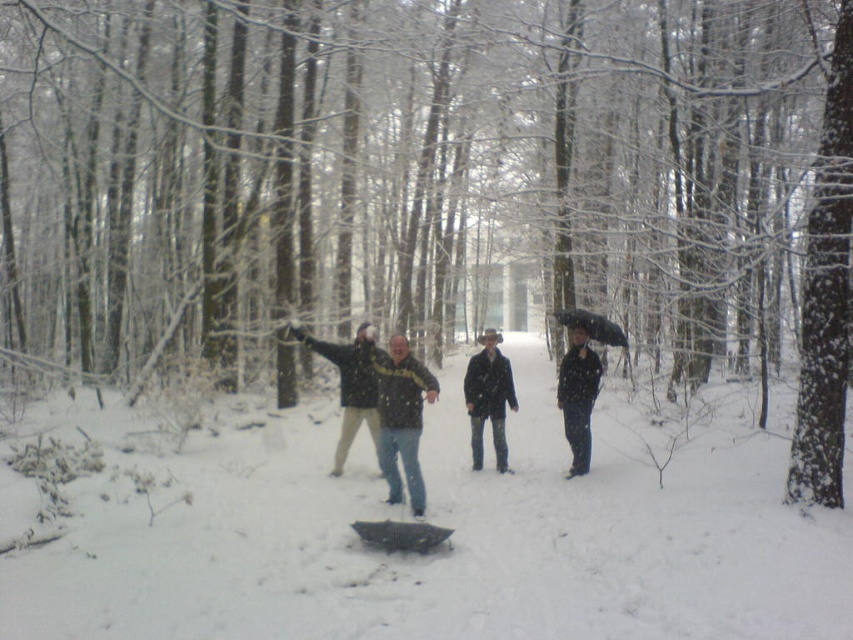
Question: Is white fluffy snow at center wider than black matte jacket at center?

Choices:
 (A) no
 (B) yes

Answer: (B)

Question: Does matte black jacket at center lie in front of black matte jacket at center?

Choices:
 (A) no
 (B) yes

Answer: (B)

Question: Which point is farther to the camera?

Choices:
 (A) matte black jacket at center
 (B) black matte jacket at center
 (C) white fluffy snow at center

Answer: (B)

Question: Which of the following is the farthest from the observer?

Choices:
 (A) white fluffy snow at center
 (B) black matte jacket at center
 (C) dark blue jeans at center

Answer: (C)

Question: Among these points, which one is farthest from the camera?

Choices:
 (A) (389, 436)
 (B) (467, 620)
 (C) (570, 410)

Answer: (C)

Question: Is white fluffy snow at center to the right of dark blue jeans at center from the viewer's perspective?

Choices:
 (A) yes
 (B) no

Answer: (B)